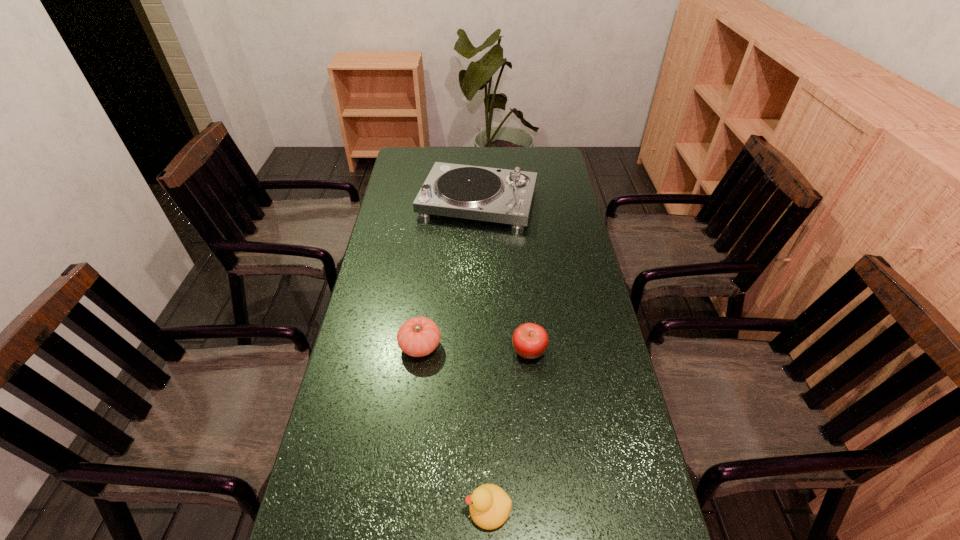
Locate an element on the screen. This screenshot has width=960, height=540. record player is located at coordinates (505, 196).

You are a GUI agent. You are given a task and a screenshot of the screen. Output one action in this format:
    pyautogui.click(x=<x>, y=<y>)
    Task: Click on the apple
    
    Given the screenshot: What is the action you would take?
    pyautogui.click(x=530, y=341)

Find the location of `tomato`. tomato is located at coordinates (419, 336).

Find the location of a particular element. The image size is (960, 540). the nearest object is located at coordinates (489, 505).

Identify the location of duckling. The width and height of the screenshot is (960, 540). (489, 505).

Find the location of a particular element. free space located 0.100m on the front of the farthest object is located at coordinates (478, 250).

This screenshot has height=540, width=960. Identify the location of vacant space situated on the back of the apple. (519, 248).

Identify the location of free spot located 0.210m on the back of the tomato. The height and width of the screenshot is (540, 960). point(428,279).

You are a GUI agent. You are given a task and a screenshot of the screen. Output one action in this format:
    pyautogui.click(x=<x>, y=<y>)
    Task: Click on the vacant space positioned 0.110m on the face of the duckling
    
    Given the screenshot: What is the action you would take?
    pyautogui.click(x=414, y=509)

Locate an element on the screen. vacant space located on the face of the duckling is located at coordinates (423, 509).